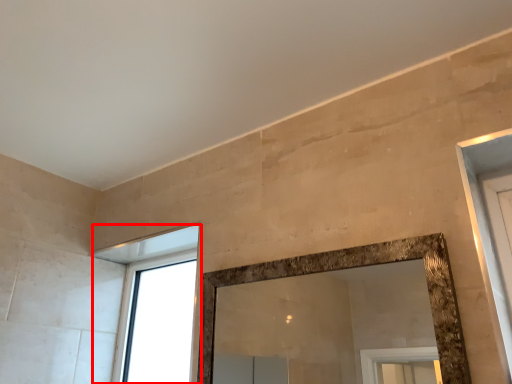
Question: From the image's perspective, what is the correct spatial relationship of window (annotated by the red box) in relation to backdrop?

Choices:
 (A) above
 (B) below

Answer: (B)